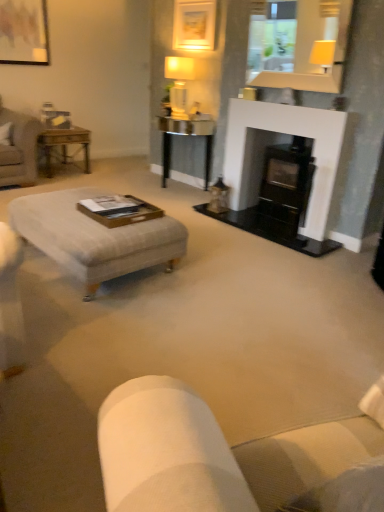
Locate an element on the screen. matte white lamp at upper center is located at coordinates (179, 84).

Based on the photo, how much space does matte gold picture frame at upper center, placed as the 2th picture frame when sorted from left to right, occupy vertically?

19.31 inches.

You are a GUI agent. You are given a task and a screenshot of the screen. Output one action in this format:
    pyautogui.click(x=<x>, y=<y>)
    Task: Click on the light gray fabric ottoman at center
    Image resolution: width=384 pixels, height=512 pixels.
    Given the screenshot: What is the action you would take?
    pyautogui.click(x=94, y=237)

Describe the element at coordinates (64, 145) in the screenshot. I see `metallic gold table at left, marked as the 2th table in a right-to-left arrangement` at that location.

Identify the location of matte white lamp at upper center. The width and height of the screenshot is (384, 512). tap(179, 84).

Considering the positions of points (186, 76) and (181, 122), is point (186, 76) closer to camera compared to point (181, 122)?

Yes, it is.

From a real-world perspective, is matte white lamp at upper center positioned over metallic glass table at center, the 1th table positioned from the right, based on gravity?

Yes.

Does matte white lamp at upper center have a greater height compared to metallic glass table at center, positioned as the second table in left-to-right order?

No.

Visually, is matte white lamp at upper center positioned to the left or to the right of metallic glass table at center, the 1th table positioned from the right?

Based on their positions, matte white lamp at upper center is located to the right of metallic glass table at center, the 1th table positioned from the right.

Who is bigger, light gray fabric ottoman at center or matte gold picture frame at upper center, placed as the 2th picture frame when sorted from left to right?

light gray fabric ottoman at center.

Does light gray fabric ottoman at center appear on the left side of matte gold picture frame at upper center, the 1th picture frame positioned from the right?

Correct, you'll find light gray fabric ottoman at center to the left of matte gold picture frame at upper center, the 1th picture frame positioned from the right.

Based on the photo, could you tell me if light gray fabric ottoman at center is turned towards matte gold picture frame at upper center, the 1th picture frame positioned from the right?

No, light gray fabric ottoman at center does not turn towards matte gold picture frame at upper center, the 1th picture frame positioned from the right.

Who is shorter, metallic glass table at center, positioned as the second table in left-to-right order, or white matte fireplace at center?

Standing shorter between the two is metallic glass table at center, positioned as the second table in left-to-right order.

Can white matte fireplace at center be found inside metallic glass table at center, positioned as the second table in left-to-right order?

No, white matte fireplace at center is located outside of metallic glass table at center, positioned as the second table in left-to-right order.

Considering the relative positions of metallic glass table at center, positioned as the second table in left-to-right order, and white matte fireplace at center in the image provided, is metallic glass table at center, positioned as the second table in left-to-right order, in front of white matte fireplace at center?

No, it is not.

Looking at this image, based on their positions, is light gray fabric ottoman at center located to the left or right of metallic gold table at left, marked as the 2th table in a right-to-left arrangement?

light gray fabric ottoman at center is to the right of metallic gold table at left, marked as the 2th table in a right-to-left arrangement.

From the image's perspective, which object appears higher, light gray fabric ottoman at center or metallic gold table at left, marked as the 2th table in a right-to-left arrangement?

From the image's view, metallic gold table at left, marked as the 2th table in a right-to-left arrangement, is above.

Can you tell me how much light gray fabric ottoman at center and metallic gold table at left, marked as the first table in a left-to-right arrangement, differ in facing direction?

The angle between the facing direction of light gray fabric ottoman at center and the facing direction of metallic gold table at left, marked as the first table in a left-to-right arrangement, is 90.1 degrees.

Is light gray fabric ottoman at center bigger than metallic gold table at left, marked as the first table in a left-to-right arrangement?

Indeed, light gray fabric ottoman at center has a larger size compared to metallic gold table at left, marked as the first table in a left-to-right arrangement.

Would you consider matte wooden picture frame at upper left, placed as the second picture frame when sorted from right to left, to be distant from matte gold picture frame at upper center, placed as the 2th picture frame when sorted from left to right?

Absolutely, matte wooden picture frame at upper left, placed as the second picture frame when sorted from right to left, is distant from matte gold picture frame at upper center, placed as the 2th picture frame when sorted from left to right.

From a real-world perspective, does matte wooden picture frame at upper left, placed as the second picture frame when sorted from right to left, sit lower than matte gold picture frame at upper center, the 1th picture frame positioned from the right?

Yes, from a real-world perspective, matte wooden picture frame at upper left, placed as the second picture frame when sorted from right to left, is beneath matte gold picture frame at upper center, the 1th picture frame positioned from the right.

Does matte wooden picture frame at upper left, placed as the second picture frame when sorted from right to left, come behind matte gold picture frame at upper center, placed as the 2th picture frame when sorted from left to right?

Yes.

Is point (335, 28) positioned in front of point (182, 116)?

Yes, point (335, 28) is in front of point (182, 116).

The height and width of the screenshot is (512, 384). In order to click on mirror on the right of matte white lamp at upper center in this screenshot , I will do `click(312, 47)`.

Is matte white lamp at upper center located within matte glass mirror at upper center?

No, matte white lamp at upper center is not inside matte glass mirror at upper center.

In the image, is matte wooden picture frame at upper left, placed as the second picture frame when sorted from right to left, on the left side or the right side of metallic glass table at center, positioned as the second table in left-to-right order?

Based on their positions, matte wooden picture frame at upper left, placed as the second picture frame when sorted from right to left, is located to the left of metallic glass table at center, positioned as the second table in left-to-right order.

From the image's perspective, is matte wooden picture frame at upper left, placed as the second picture frame when sorted from right to left, above or below metallic glass table at center, the 1th table positioned from the right?

matte wooden picture frame at upper left, placed as the second picture frame when sorted from right to left, is situated higher than metallic glass table at center, the 1th table positioned from the right, in the image.

Identify the location of the 2nd table counting from the right of the matte wooden picture frame at upper left, placed as the 1th picture frame when sorted from left to right. Image resolution: width=384 pixels, height=512 pixels. (186, 135).

From a real-world perspective, is matte wooden picture frame at upper left, placed as the second picture frame when sorted from right to left, positioned above or below metallic glass table at center, positioned as the second table in left-to-right order?

From a real-world perspective, matte wooden picture frame at upper left, placed as the second picture frame when sorted from right to left, is physically above metallic glass table at center, positioned as the second table in left-to-right order.

From the image's perspective, which table is the 2nd one below the matte white lamp at upper center? Please provide its 2D coordinates.

[(186, 135)]

From the image's perspective, starting from the light gray fabric ottoman at center, which picture frame is the 1st one above? Please provide its 2D coordinates.

[(194, 24)]

Consider the image. Based on their spatial positions, is metallic gold table at left, marked as the first table in a left-to-right arrangement, or white matte fireplace at center closer to metallic glass table at center, the 1th table positioned from the right?

The object closer to metallic glass table at center, the 1th table positioned from the right, is white matte fireplace at center.

From the image, which object appears to be farther from metallic gold table at left, marked as the 2th table in a right-to-left arrangement, metallic glass table at center, the 1th table positioned from the right, or matte white lamp at upper center?

matte white lamp at upper center is positioned further to the anchor metallic gold table at left, marked as the 2th table in a right-to-left arrangement.

Considering their positions, is metallic gold table at left, marked as the first table in a left-to-right arrangement, positioned further to white matte fireplace at center than matte wooden picture frame at upper left, placed as the 1th picture frame when sorted from left to right?

The object further to white matte fireplace at center is matte wooden picture frame at upper left, placed as the 1th picture frame when sorted from left to right.

Based on their spatial positions, is metallic gold table at left, marked as the 2th table in a right-to-left arrangement, or matte glass mirror at upper center further from matte wooden picture frame at upper left, placed as the second picture frame when sorted from right to left?

matte glass mirror at upper center is positioned further to the anchor matte wooden picture frame at upper left, placed as the second picture frame when sorted from right to left.

Considering their positions, is metallic glass table at center, the 1th table positioned from the right, positioned further to light gray fabric ottoman at center than white matte fireplace at center?

metallic glass table at center, the 1th table positioned from the right, is positioned further to the anchor light gray fabric ottoman at center.

Looking at the image, which one is located closer to metallic gold table at left, marked as the first table in a left-to-right arrangement, white matte fireplace at center or metallic glass table at center, positioned as the second table in left-to-right order?

The object closer to metallic gold table at left, marked as the first table in a left-to-right arrangement, is metallic glass table at center, positioned as the second table in left-to-right order.

Estimate the real-world distances between objects in this image. Which object is further from matte glass mirror at upper center, white matte fireplace at center or light gray fabric ottoman at center?

Among the two, light gray fabric ottoman at center is located further to matte glass mirror at upper center.

Estimate the real-world distances between objects in this image. Which object is further from matte glass mirror at upper center, metallic glass table at center, positioned as the second table in left-to-right order, or matte wooden picture frame at upper left, placed as the second picture frame when sorted from right to left?

matte wooden picture frame at upper left, placed as the second picture frame when sorted from right to left.

The width and height of the screenshot is (384, 512). Find the location of `lamp between light gray fabric ottoman at center and metallic gold table at left, marked as the first table in a left-to-right arrangement, along the z-axis`. lamp between light gray fabric ottoman at center and metallic gold table at left, marked as the first table in a left-to-right arrangement, along the z-axis is located at coordinates (179, 84).

The height and width of the screenshot is (512, 384). Identify the location of fireplace between light gray fabric ottoman at center and metallic gold table at left, marked as the 2th table in a right-to-left arrangement, along the z-axis. (285, 143).

Find the location of a particular element. table between metallic gold table at left, marked as the first table in a left-to-right arrangement, and white matte fireplace at center is located at coordinates (186, 135).

At what (x,y) coordinates should I click in order to perform the action: click on table between light gray fabric ottoman at center and matte white lamp at upper center from front to back. Please return your answer as a coordinate pair (x, y). Looking at the image, I should click on [186, 135].